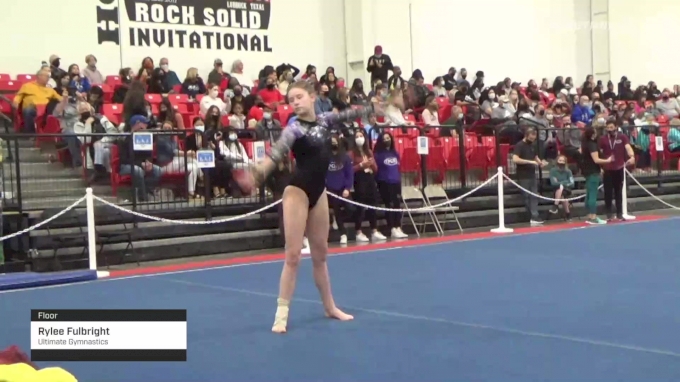
Where is `wall`? wall is located at coordinates (35, 31).